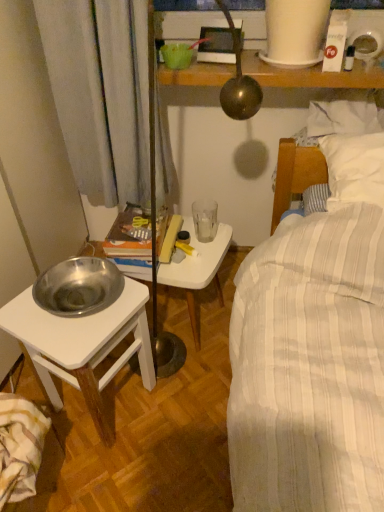
You are a GUI agent. You are given a task and a screenshot of the screen. Output one action in this format:
    pyautogui.click(x=<x>, y=<y>)
    Task: Click on the vacant space in front of transparent glass at center
    This screenshot has height=512, width=384.
    Given the screenshot: What is the action you would take?
    pyautogui.click(x=200, y=261)